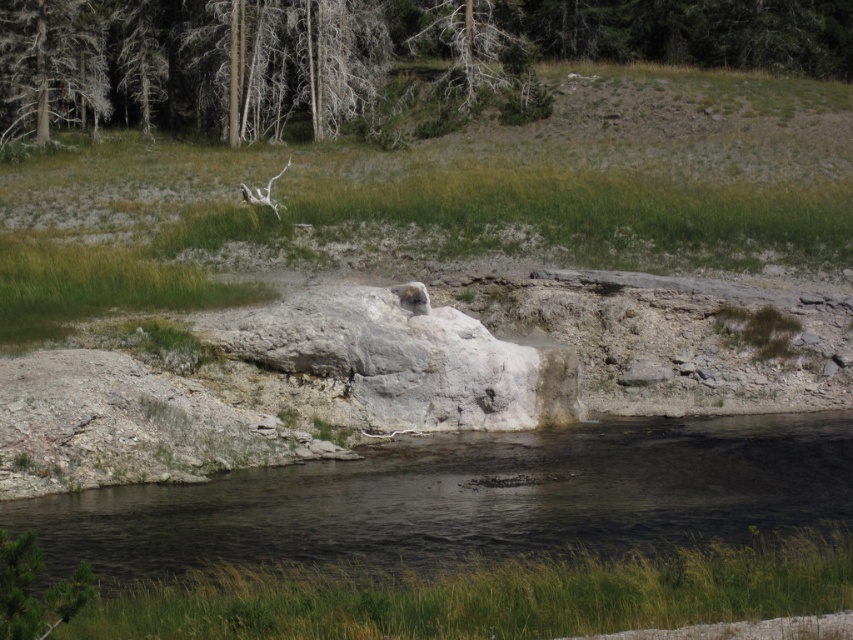
Which is more to the right, black smooth water at lower center or dead wood at upper left?

black smooth water at lower center is more to the right.

Does point (264, 502) come behind point (54, 12)?

No, (264, 502) is in front of (54, 12).

Measure the distance between point (699,481) and camera.

They are 99.65 feet apart.

Locate an element on the screen. Image resolution: width=853 pixels, height=640 pixels. black smooth water at lower center is located at coordinates (469, 499).

Can you confirm if dead wood at upper left is taller than dead wood tree at upper center?

No.

You are a GUI agent. You are given a task and a screenshot of the screen. Output one action in this format:
    pyautogui.click(x=<x>, y=<y>)
    Task: Click on the dead wood at upper left
    This screenshot has height=640, width=853.
    Given the screenshot: What is the action you would take?
    pyautogui.click(x=51, y=64)

At what (x,y) coordinates should I click in order to perform the action: click on dead wood at upper left. Please return your answer as a coordinate pair (x, y). Looking at the image, I should click on (51, 64).

Based on the photo, between black smooth water at lower center and dead wood tree at upper center, which one appears on the right side from the viewer's perspective?

From the viewer's perspective, black smooth water at lower center appears more on the right side.

Which is in front, point (387, 493) or point (482, 20)?

Point (387, 493) is more forward.

Locate an element on the screen. This screenshot has height=640, width=853. black smooth water at lower center is located at coordinates (469, 499).